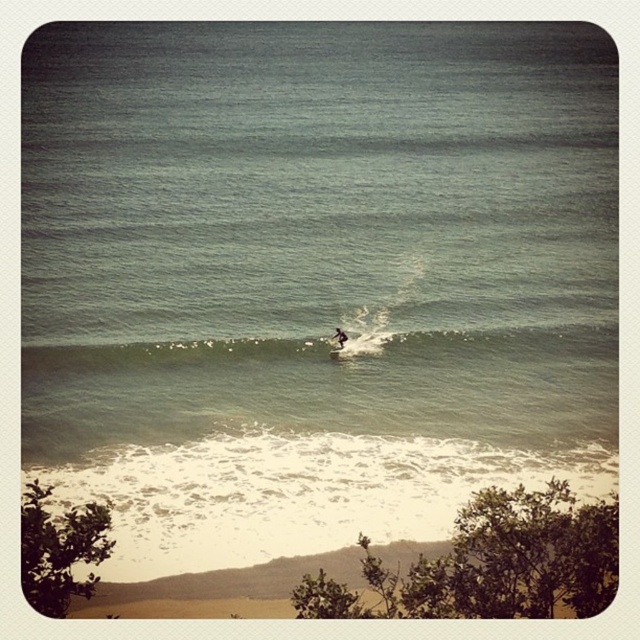
Based on the photo, you are a photographer planning to capture the white matte surfboard at center in the center of your photo frame. Based on the scene description, is the surfboard already positioned at the center of the image?

The white matte surfboard at center is located at the 2D coordinates point [339,337], which is very close to the center of the image. Since the coordinates are nearly 0.5 in both x and y axes, it can be considered centered for most practical purposes.